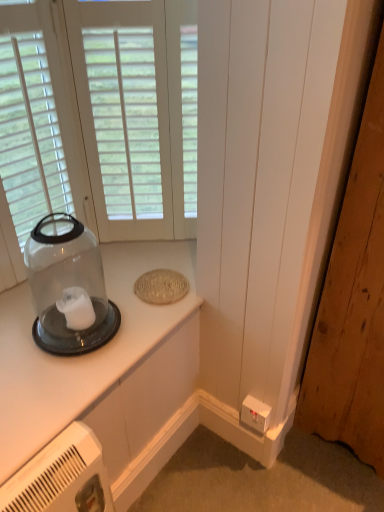
Identify the location of free point in front of transparent glass jar at left. (54, 384).